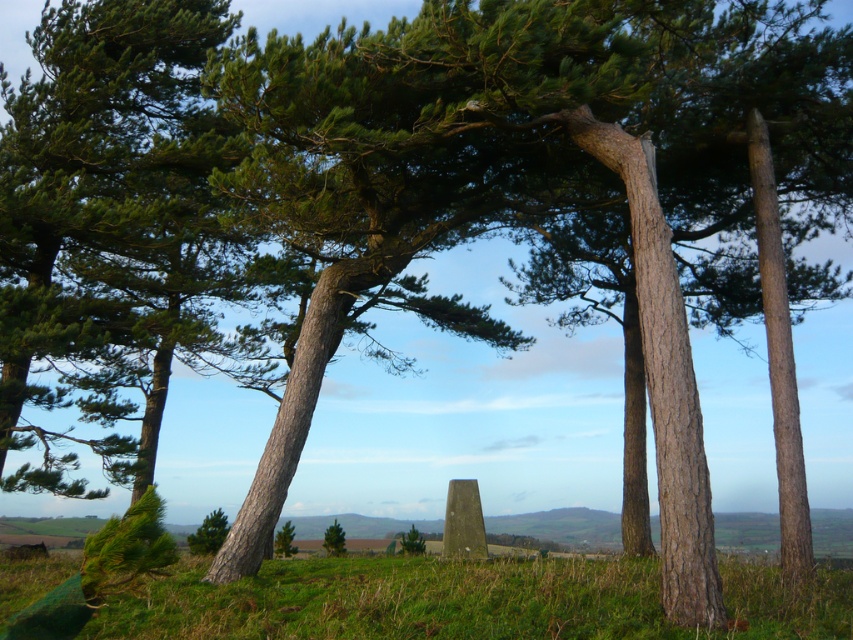
Question: Is green grassy at lower left bigger than green rough bark tree at lower center?

Choices:
 (A) no
 (B) yes

Answer: (B)

Question: Which point appears closest to the camera in this image?

Choices:
 (A) (566, 570)
 (B) (283, 556)

Answer: (A)

Question: Which of the following is the farthest from the observer?

Choices:
 (A) (339, 531)
 (B) (624, 604)

Answer: (A)

Question: Which object is the closest to the green grassy at lower left?

Choices:
 (A) green rough bark tree at lower center
 (B) green matte tree at lower left

Answer: (A)

Question: Can you confirm if green grassy at lower left is positioned to the right of green rough bark tree at lower center?

Choices:
 (A) no
 (B) yes

Answer: (B)

Question: Is green grassy at lower left below green rough bark tree at lower center?

Choices:
 (A) no
 (B) yes

Answer: (A)